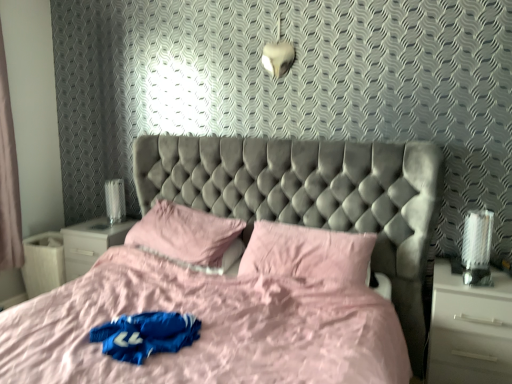
The image size is (512, 384). Find the location of `free space above white glossy nightstand at right, arranged as the 1th nightstand when viewed from the front (from a real-world perspective)`. free space above white glossy nightstand at right, arranged as the 1th nightstand when viewed from the front (from a real-world perspective) is located at coordinates (482, 278).